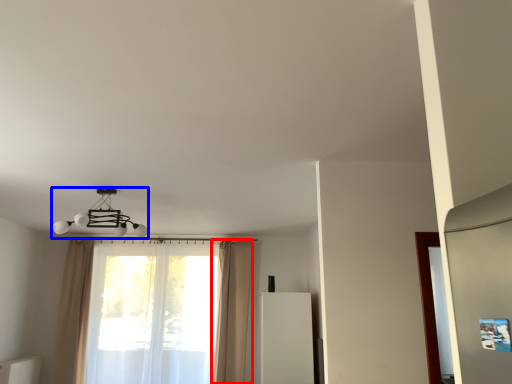
Question: Which object is closer to the camera taking this photo, curtain (highlighted by a red box) or lamp (highlighted by a blue box)?

Choices:
 (A) curtain
 (B) lamp

Answer: (B)